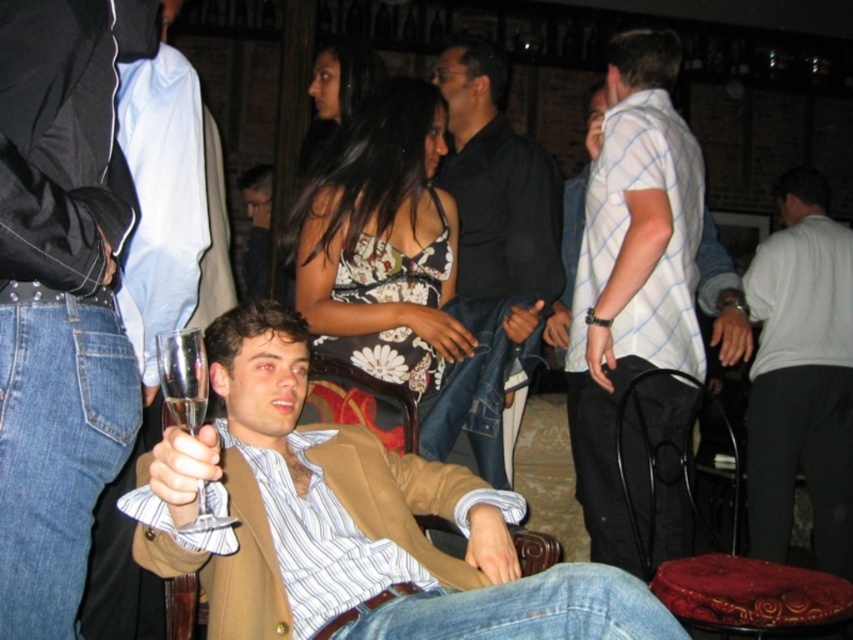
You are a photographer at the event and want to capture a photo of the matte brown blazer at center and the dark brown hair at upper center in the same frame. Given that your camera has a focal length of 50mm and a sensor size of 24mm x 36mm, what is the minimum distance you need to stand from the subjects to ensure both are in the frame?

The matte brown blazer at center and the dark brown hair at upper center are 1.94 meters apart. To include both in the frame with a 50mm lens and a 24mm x 36mm sensor, the minimum distance should be approximately 2.6 meters. This calculation uses the formula for field of view width at 50mm, which covers about 46 degrees horizontally. At 2.6 meters, the horizontal coverage would be roughly 2 meters, accommodating the 1.94 meter separation between the subjects.

You are at a social event and want to know if the matte brown blazer at center is taller than the dark brown hair at upper center. Can you determine this based on the scene?

The matte brown blazer at center is not as tall as the dark brown hair at upper center, so the dark brown hair at upper center is taller.